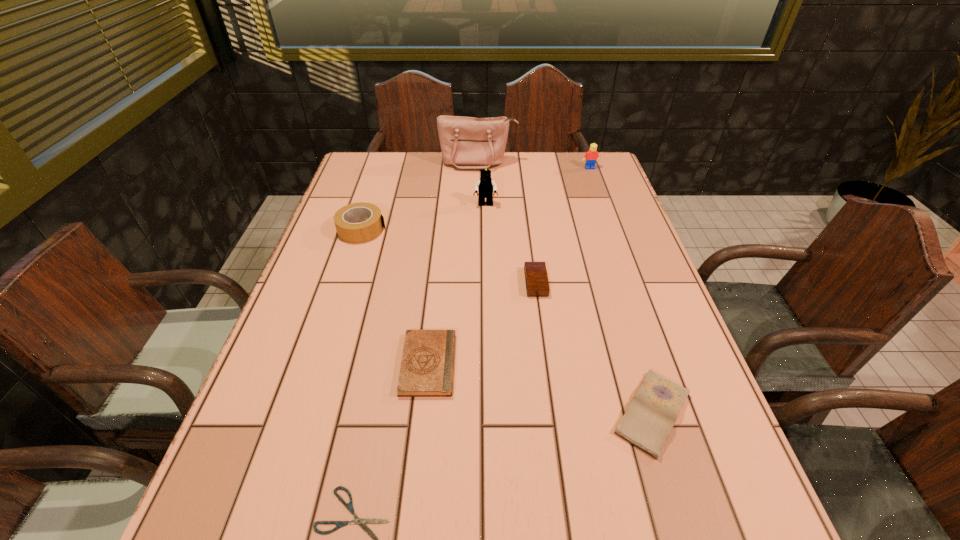
This screenshot has width=960, height=540. In the image, there is a desktop. Find the location of `vacant space at the near left corner`. vacant space at the near left corner is located at coordinates (199, 530).

The image size is (960, 540). Identify the location of free space at the far right corner of the desktop. (611, 178).

The width and height of the screenshot is (960, 540). In order to click on empty space that is in between the left diary and the duct tape in this screenshot , I will do `click(396, 296)`.

Where is `free spot between the shoulder bag and the right diary`? The width and height of the screenshot is (960, 540). free spot between the shoulder bag and the right diary is located at coordinates (565, 288).

Find the location of a particular element. This screenshot has width=960, height=540. free spot between the fifth shortest object and the alarm clock is located at coordinates (449, 256).

Identify the location of free space between the fourth shortest object and the shoulder bag. This screenshot has width=960, height=540. (507, 222).

You are a GUI agent. You are given a task and a screenshot of the screen. Output one action in this format:
    pyautogui.click(x=<x>, y=<y>)
    Task: Click on the free area in between the tallest object and the left diary
    The height and width of the screenshot is (540, 960).
    Given the screenshot: What is the action you would take?
    pyautogui.click(x=453, y=264)

What are the coordinates of `free space between the nearer Lego and the leftmost object` in the screenshot? It's located at (423, 217).

Where is `the seventh closest object relative to the shoulder bag`? the seventh closest object relative to the shoulder bag is located at coordinates (357, 520).

Identify which object is located as the fifth nearest to the left diary. Please provide its 2D coordinates. Your answer should be formatted as a tuple, i.e. [(x, y)], where the tuple contains the x and y coordinates of a point satisfying the conditions above.

[(485, 186)]